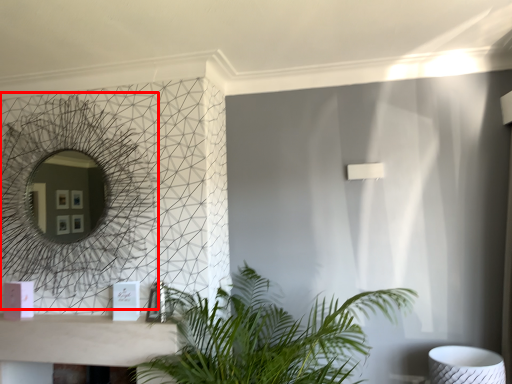
Question: From the image's perspective, considering the relative positions of mirror (annotated by the red box) and houseplant in the image provided, where is mirror (annotated by the red box) located with respect to the staircase?

Choices:
 (A) below
 (B) above

Answer: (B)